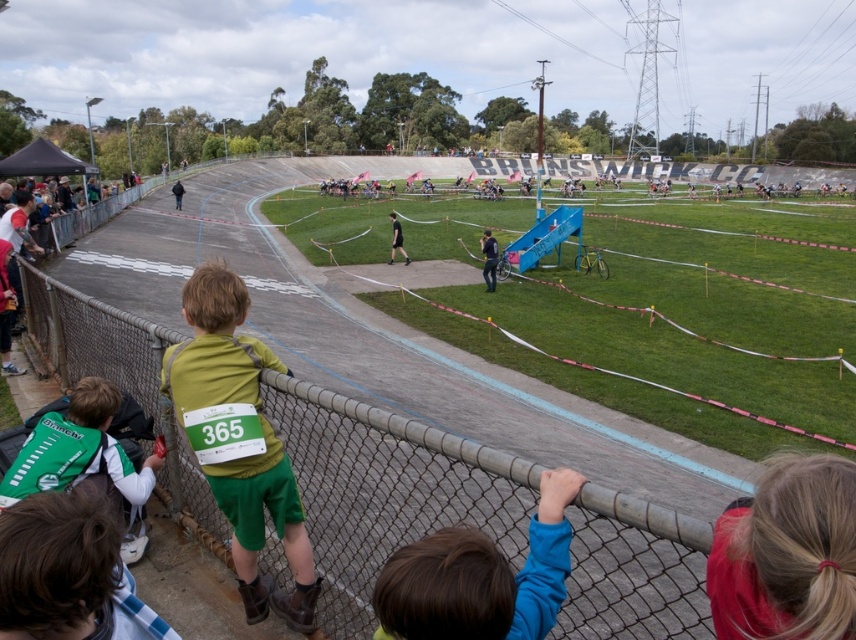
How distant is blue fleece at lower center from dark blue jacket at center?

blue fleece at lower center is 38.87 meters from dark blue jacket at center.

Can you confirm if blue fleece at lower center is positioned below dark blue jacket at center?

Indeed, blue fleece at lower center is positioned under dark blue jacket at center.

The image size is (856, 640). Describe the element at coordinates (480, 577) in the screenshot. I see `blue fleece at lower center` at that location.

Locate an element on the screen. The image size is (856, 640). blue fleece at lower center is located at coordinates (480, 577).

Based on the photo, who is more distant from viewer, (767, 572) or (462, 589)?

The point (462, 589) is behind.

Find the location of a particular element. The image size is (856, 640). blonde hair at upper right is located at coordinates (788, 554).

Does metal mesh fence at center appear under green fabric backpack at left?

Yes.

Can you confirm if metal mesh fence at center is positioned to the right of green fabric backpack at left?

Correct, you'll find metal mesh fence at center to the right of green fabric backpack at left.

Locate an element on the screen. Image resolution: width=856 pixels, height=640 pixels. metal mesh fence at center is located at coordinates (385, 490).

Locate an element on the screen. metal mesh fence at center is located at coordinates (385, 490).